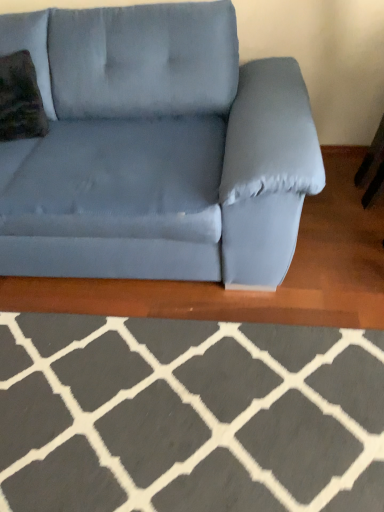
Question: Is gray wool rug at lower center facing towards velvety green throw pillow at upper left?

Choices:
 (A) yes
 (B) no

Answer: (B)

Question: Is gray wool rug at lower center outside of velvety green throw pillow at upper left?

Choices:
 (A) no
 (B) yes

Answer: (B)

Question: Considering the relative positions of gray wool rug at lower center and velvety green throw pillow at upper left in the image provided, is gray wool rug at lower center to the right of velvety green throw pillow at upper left from the viewer's perspective?

Choices:
 (A) no
 (B) yes

Answer: (B)

Question: Considering the relative sizes of gray wool rug at lower center and velvety green throw pillow at upper left in the image provided, is gray wool rug at lower center smaller than velvety green throw pillow at upper left?

Choices:
 (A) yes
 (B) no

Answer: (B)

Question: From a real-world perspective, is gray wool rug at lower center below velvety green throw pillow at upper left?

Choices:
 (A) no
 (B) yes

Answer: (B)

Question: Considering the positions of gray wool rug at lower center and velvety green throw pillow at upper left in the image, is gray wool rug at lower center taller or shorter than velvety green throw pillow at upper left?

Choices:
 (A) short
 (B) tall

Answer: (A)

Question: Relative to velvety green throw pillow at upper left, is gray wool rug at lower center in front or behind?

Choices:
 (A) front
 (B) behind

Answer: (A)

Question: From the image's perspective, is gray wool rug at lower center positioned above or below velvety green throw pillow at upper left?

Choices:
 (A) above
 (B) below

Answer: (B)

Question: In terms of size, does gray wool rug at lower center appear bigger or smaller than velvety green throw pillow at upper left?

Choices:
 (A) big
 (B) small

Answer: (A)

Question: From the image's perspective, is gray wool rug at lower center positioned above or below suede blue couch at center?

Choices:
 (A) above
 (B) below

Answer: (B)

Question: Looking at their shapes, would you say gray wool rug at lower center is wider or thinner than suede blue couch at center?

Choices:
 (A) wide
 (B) thin

Answer: (A)

Question: In the image, is gray wool rug at lower center positioned in front of or behind suede blue couch at center?

Choices:
 (A) front
 (B) behind

Answer: (A)

Question: From their relative heights in the image, would you say gray wool rug at lower center is taller or shorter than suede blue couch at center?

Choices:
 (A) short
 (B) tall

Answer: (A)

Question: Does point (6, 100) appear closer or farther from the camera than point (140, 453)?

Choices:
 (A) farther
 (B) closer

Answer: (A)

Question: Is velvety green throw pillow at upper left bigger or smaller than gray wool rug at lower center?

Choices:
 (A) big
 (B) small

Answer: (B)